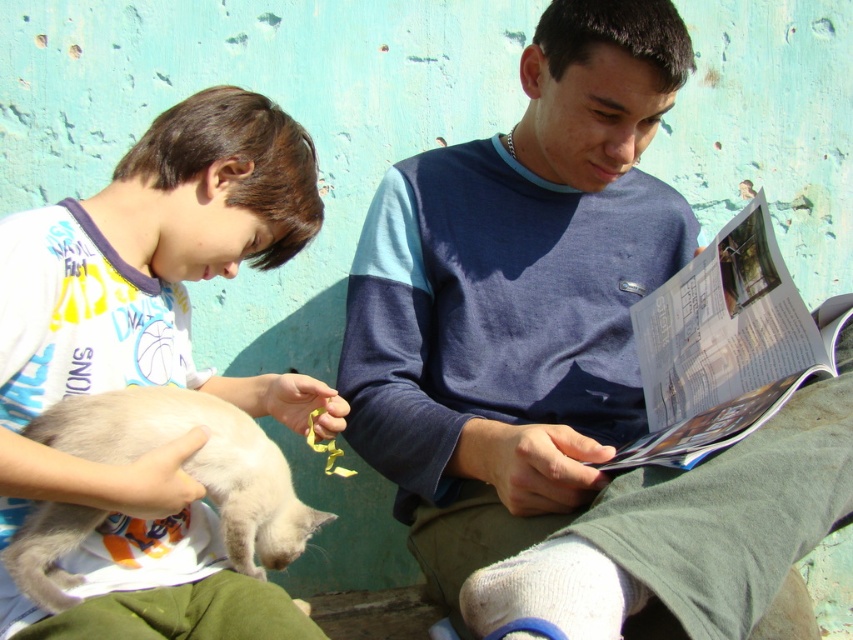
Can you confirm if white fur cat at lower left is smaller than silky white cat at lower left?

Actually, white fur cat at lower left might be larger than silky white cat at lower left.

What do you see at coordinates (151, 362) in the screenshot? I see `white fur cat at lower left` at bounding box center [151, 362].

Locate an element on the screen. white fur cat at lower left is located at coordinates (151, 362).

Is point (764, 456) more distant than point (152, 472)?

That is False.

Who is positioned more to the left, blue cotton shirt at center or white fur cat at lower left?

Positioned to the left is white fur cat at lower left.

Does point (787, 554) come farther from viewer compared to point (225, 394)?

No, (787, 554) is closer to viewer.

Locate an element on the screen. The height and width of the screenshot is (640, 853). blue cotton shirt at center is located at coordinates (567, 364).

Is point (515, 419) positioned in front of point (258, 490)?

That is False.

Who is lower down, blue cotton shirt at center or silky white cat at lower left?

silky white cat at lower left is below.

What are the coordinates of `blue cotton shirt at center` in the screenshot? It's located at point(567,364).